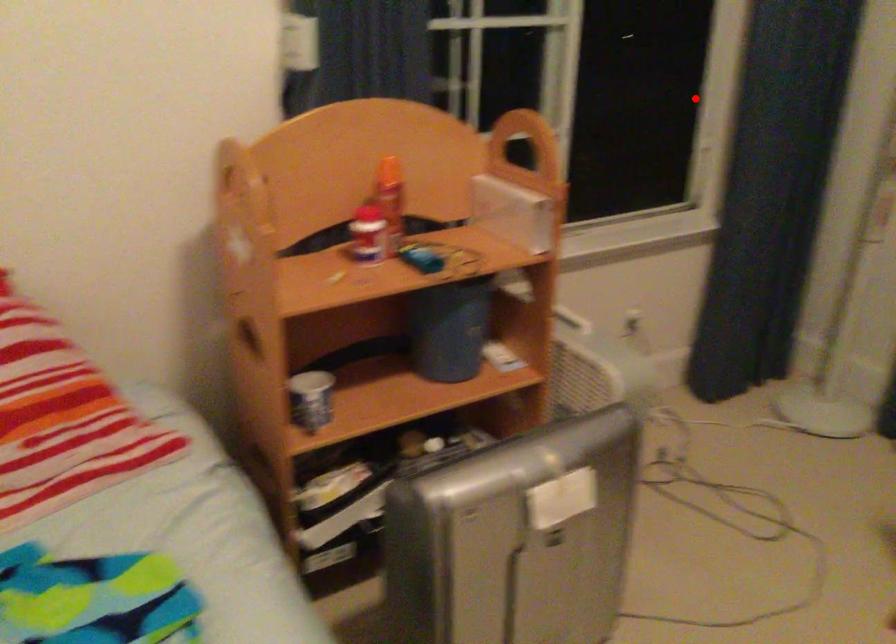
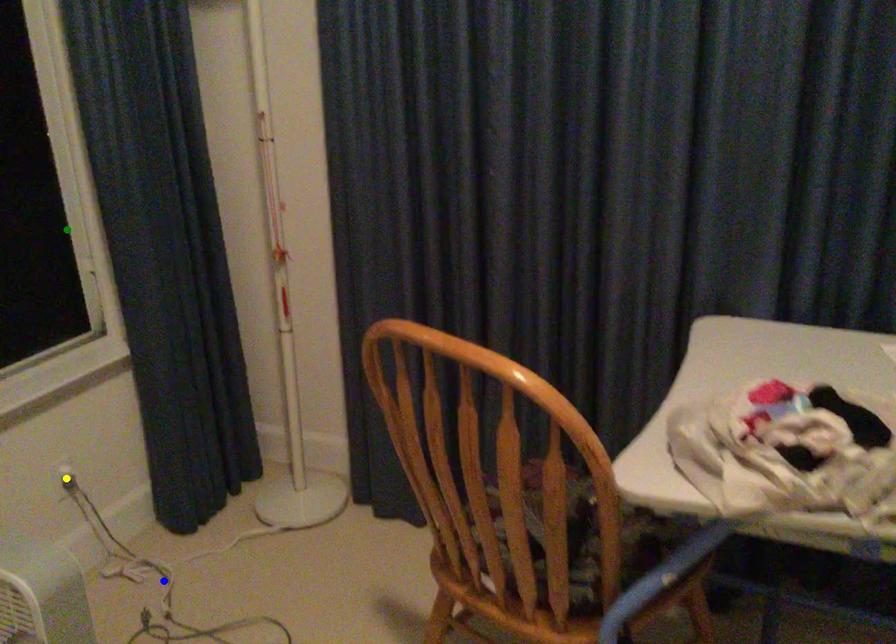
Question: I am providing you with two images of the same scene from different viewpoints. A red point is marked on the first image. You are given multiple points on the second image. Which mark in image 2 goes with the point in image 1?

Choices:
 (A) yellow point
 (B) blue point
 (C) green point

Answer: (C)